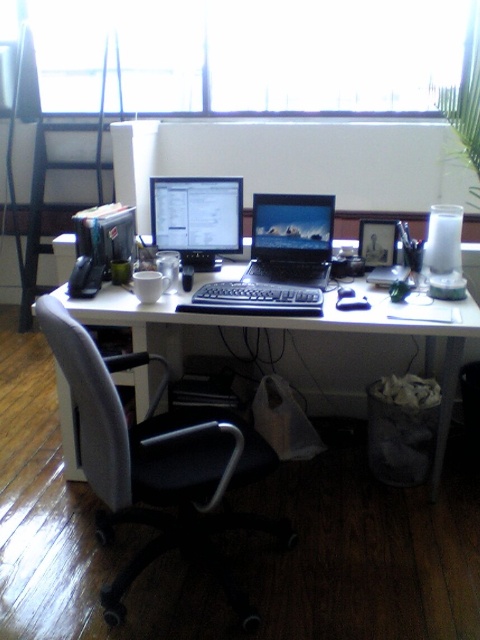
Locate an element on the screen. gray fabric swivel chair at center is located at coordinates (157, 464).

Between gray fabric swivel chair at center and white plastic computer desk at center, which one has less height?

Standing shorter between the two is gray fabric swivel chair at center.

Between point (241, 604) and point (118, 314), which one is positioned in front?

Point (241, 604) is in front.

Locate an element on the screen. The width and height of the screenshot is (480, 640). gray fabric swivel chair at center is located at coordinates (157, 464).

In order to click on matte black monitor at center in this screenshot , I will do `click(196, 218)`.

The height and width of the screenshot is (640, 480). What do you see at coordinates (196, 218) in the screenshot?
I see `matte black monitor at center` at bounding box center [196, 218].

Locate an element on the screen. matte black monitor at center is located at coordinates (196, 218).

Is transparent glass window at upper center in front of matte black monitor at center?

No.

Which is below, transparent glass window at upper center or matte black monitor at center?

matte black monitor at center

Between point (398, 33) and point (156, 227), which one is positioned behind?

The point (398, 33) is behind.

Locate an element on the screen. The width and height of the screenshot is (480, 640). transparent glass window at upper center is located at coordinates (247, 52).